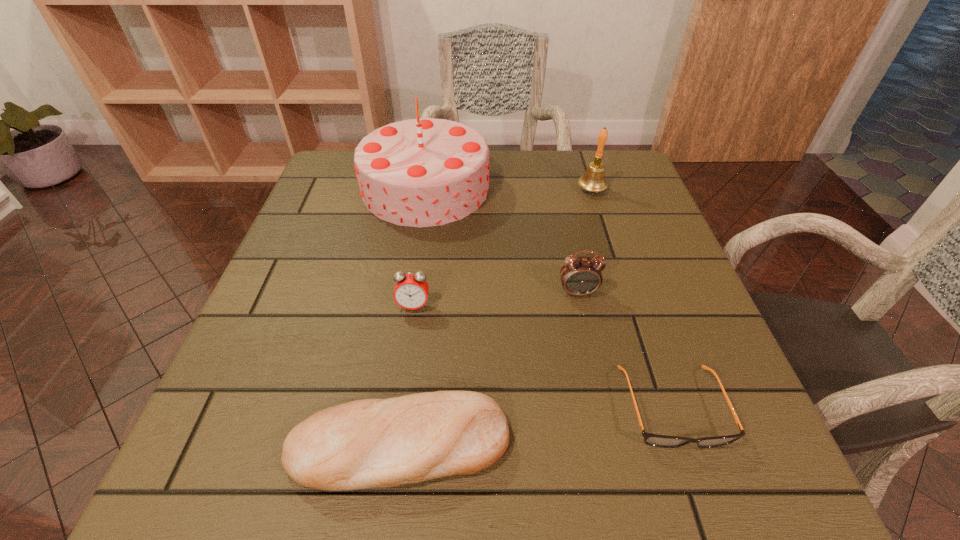
You are a GUI agent. You are given a task and a screenshot of the screen. Output one action in this format:
    pyautogui.click(x=<x>, y=<y>)
    Task: Click on the object situated at the far left corner
    This screenshot has width=960, height=540.
    Given the screenshot: What is the action you would take?
    pyautogui.click(x=424, y=172)

You are a GUI agent. You are given a task and a screenshot of the screen. Output one action in this format:
    pyautogui.click(x=<x>, y=<y>)
    Task: Click on the object at the near left corner
    The height and width of the screenshot is (540, 960).
    Given the screenshot: What is the action you would take?
    pyautogui.click(x=371, y=443)

Identify the location of object present at the far right corner. (593, 180).

You are a GUI agent. You are given a task and a screenshot of the screen. Output one action in this format:
    pyautogui.click(x=<x>, y=<y>)
    Task: Click on the object that is at the near right corner
    
    Given the screenshot: What is the action you would take?
    pyautogui.click(x=655, y=440)

Identify the location of free space at the far edge. (502, 172).

Locate an element on the screen. This screenshot has width=960, height=540. vacant space at the left edge is located at coordinates (325, 293).

Locate an element on the screen. Image resolution: width=960 pixels, height=540 pixels. vacant space at the right edge of the desktop is located at coordinates click(664, 308).

The height and width of the screenshot is (540, 960). In the image, there is a desktop. Identify the location of vacant area at the near right corner. (715, 487).

You are a GUI agent. You are given a task and a screenshot of the screen. Output one action in this format:
    pyautogui.click(x=<x>, y=<y>)
    Task: Click on the vacant region between the second tallest object and the left alarm clock
    The height and width of the screenshot is (540, 960).
    Given the screenshot: What is the action you would take?
    pyautogui.click(x=503, y=248)

Locate an element on the screen. The height and width of the screenshot is (540, 960). blank region between the third tallest object and the shortest object is located at coordinates (625, 349).